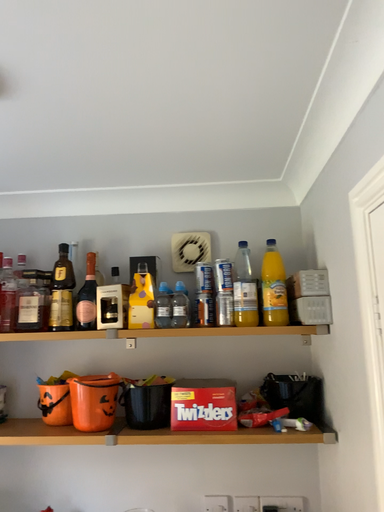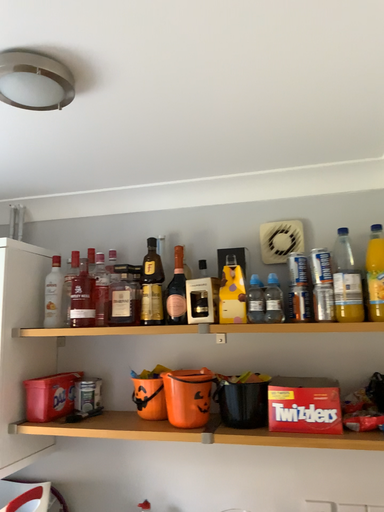
Question: Which way did the camera rotate in the video?

Choices:
 (A) rotated left
 (B) rotated right

Answer: (A)